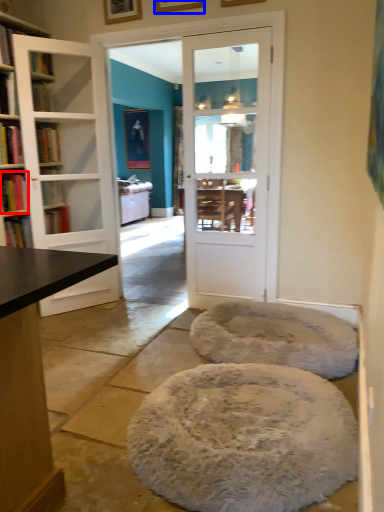
Question: Which object appears farthest to the camera in this image, book (highlighted by a red box) or picture frame (highlighted by a blue box)?

Choices:
 (A) book
 (B) picture frame

Answer: (A)